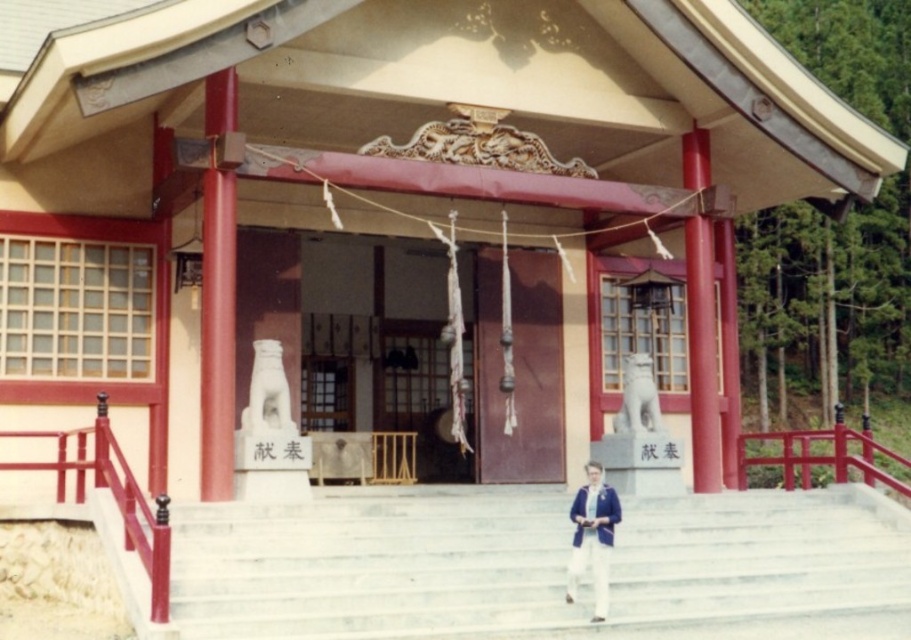
Can you confirm if white marble stairs at center is thinner than blue fabric jacket at center?

No, white marble stairs at center is not thinner than blue fabric jacket at center.

Does white marble stairs at center come in front of blue fabric jacket at center?

Yes, white marble stairs at center is closer to the viewer.

Does point (447, 579) come in front of point (592, 461)?

That is True.

At what (x,y) coordinates should I click in order to perform the action: click on white marble stairs at center. Please return your answer as a coordinate pair (x, y). This screenshot has width=911, height=640. Looking at the image, I should click on (540, 564).